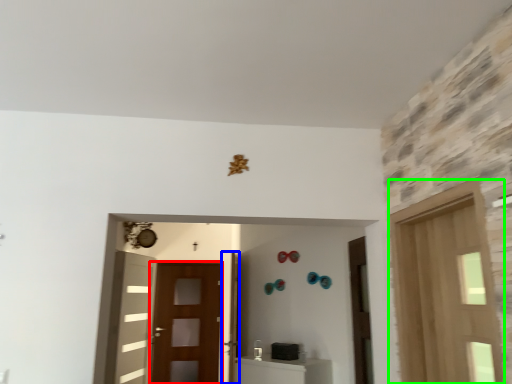
Question: Which is farther away from screen door (highlighted by a red box)? door (highlighted by a blue box) or door (highlighted by a green box)?

Choices:
 (A) door
 (B) door

Answer: (B)